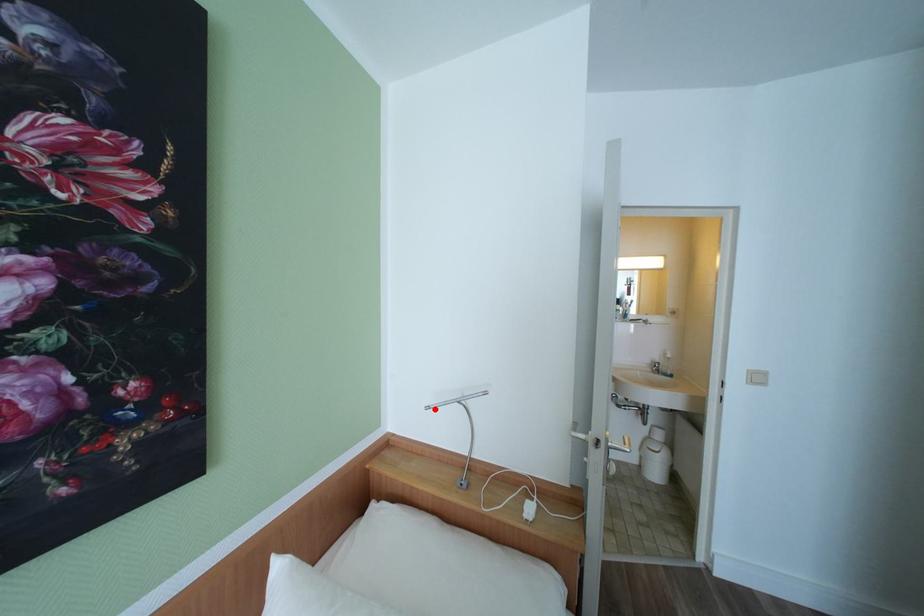
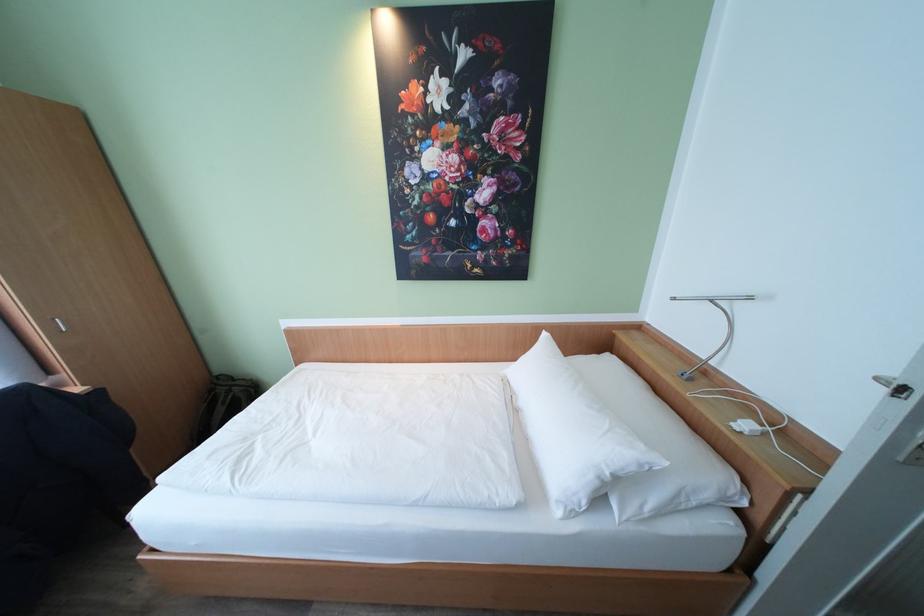
Question: I am providing you with two images of the same scene from different viewpoints. In image1, a red point is highlighted. Considering the same 3D point in image2, which of the following is correct?

Choices:
 (A) It is closer
 (B) It is farther

Answer: (A)